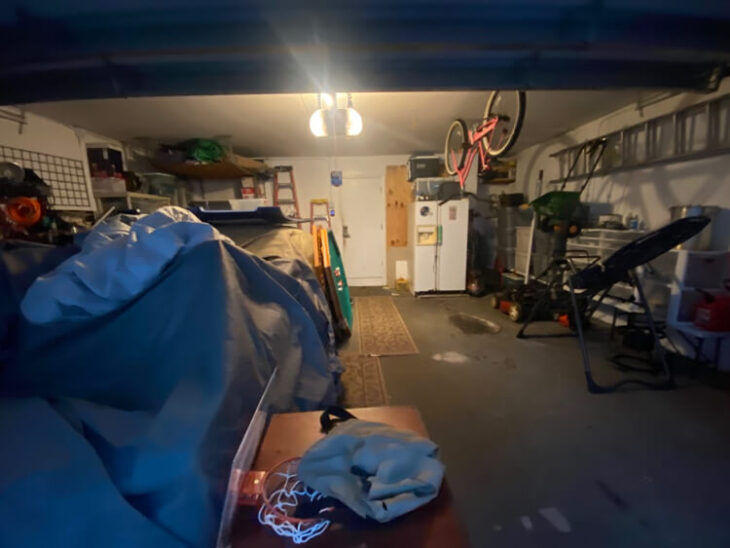
The image size is (730, 548). I want to click on light, so click(x=355, y=122), click(x=318, y=122).